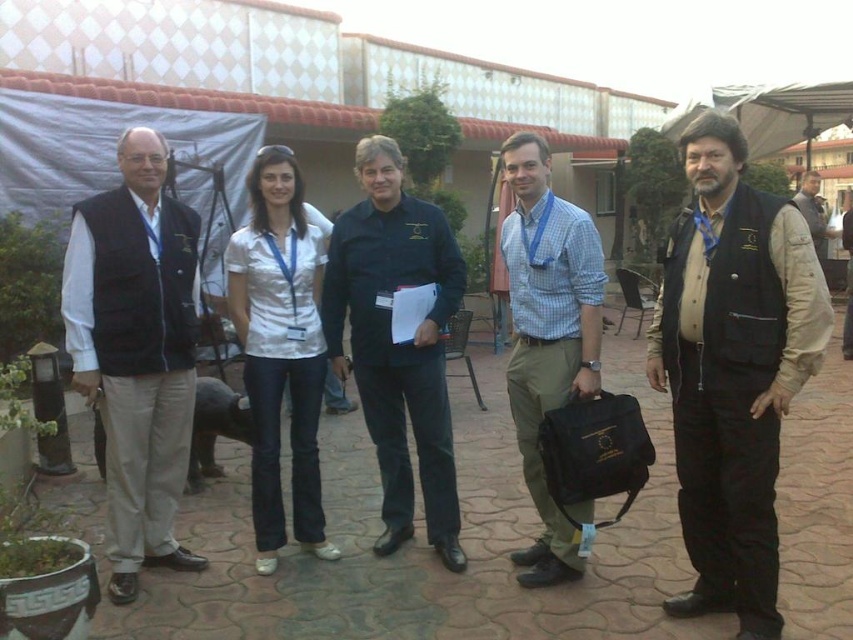
Is the position of white glossy shirt at center more distant than that of brown leather jacket at center?

No.

Between white glossy shirt at center and brown leather jacket at center, which one appears on the left side from the viewer's perspective?

From the viewer's perspective, white glossy shirt at center appears more on the left side.

What do you see at coordinates (280, 349) in the screenshot?
I see `white glossy shirt at center` at bounding box center [280, 349].

This screenshot has width=853, height=640. Identify the location of white glossy shirt at center. pos(280,349).

Which of these two, black shirt at center or brown leather jacket at center, stands shorter?

Standing shorter between the two is brown leather jacket at center.

Can you confirm if black shirt at center is bigger than brown leather jacket at center?

Actually, black shirt at center might be smaller than brown leather jacket at center.

Which is in front, point (438, 531) or point (825, 228)?

Point (438, 531) is in front.

The height and width of the screenshot is (640, 853). Identify the location of black shirt at center. (397, 342).

Does blue checkered shirt at center appear under brown leather jacket at center?

Correct, blue checkered shirt at center is located below brown leather jacket at center.

Who is more forward, (517, 330) or (811, 220)?

Point (517, 330)

Is point (569, 353) positioned in front of point (814, 221)?

Yes, point (569, 353) is in front of point (814, 221).

Find the location of a particular element. The width and height of the screenshot is (853, 640). blue checkered shirt at center is located at coordinates (547, 333).